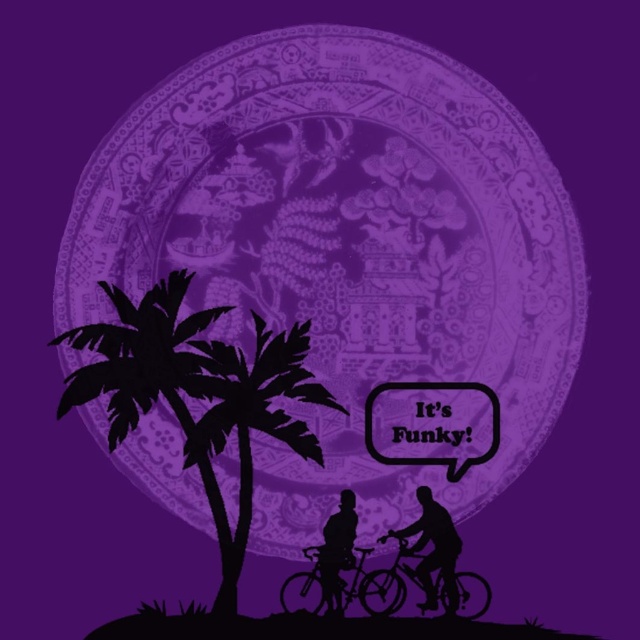
Question: Observing the image, what is the correct spatial positioning of black silhouette palm tree at left in reference to metallic bicycle at center?

Choices:
 (A) above
 (B) below

Answer: (A)

Question: Is black silhouette palm tree at center positioned behind metallic bicycle at lower right?

Choices:
 (A) no
 (B) yes

Answer: (A)

Question: Which point is farther to the camera?

Choices:
 (A) metallic bicycle at center
 (B) metallic bicycle at lower right
 (C) black matte bicycle at lower right

Answer: (C)

Question: Is black silhouette bicycle at lower center smaller than black silhouette palm tree at center?

Choices:
 (A) yes
 (B) no

Answer: (B)

Question: Which of the following is the closest to the observer?

Choices:
 (A) metallic bicycle at center
 (B) black silhouette palm tree at left
 (C) silhouette bicycle rider at lower center
 (D) black silhouette palm tree at center

Answer: (B)

Question: Which object appears closest to the camera in this image?

Choices:
 (A) metallic bicycle at lower right
 (B) black silhouette palm tree at center
 (C) black silhouette palm tree at left
 (D) black silhouette bicycle at lower center

Answer: (C)